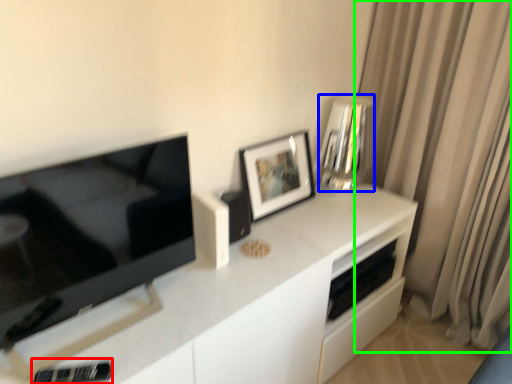
Question: Which is farther away from appliance (highlighted by a red box)? appliance (highlighted by a blue box) or curtain (highlighted by a green box)?

Choices:
 (A) appliance
 (B) curtain

Answer: (B)